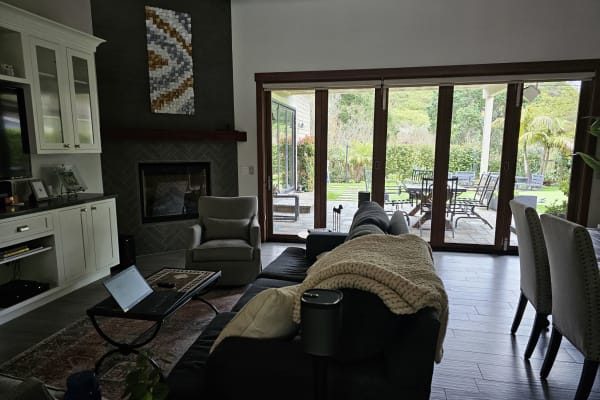
You are a GUI agent. You are given a task and a screenshot of the screen. Output one action in this format:
    pyautogui.click(x=<x>, y=<y>)
    Task: Click on the accent rug
    
    Given the screenshot: What is the action you would take?
    pyautogui.click(x=56, y=361)